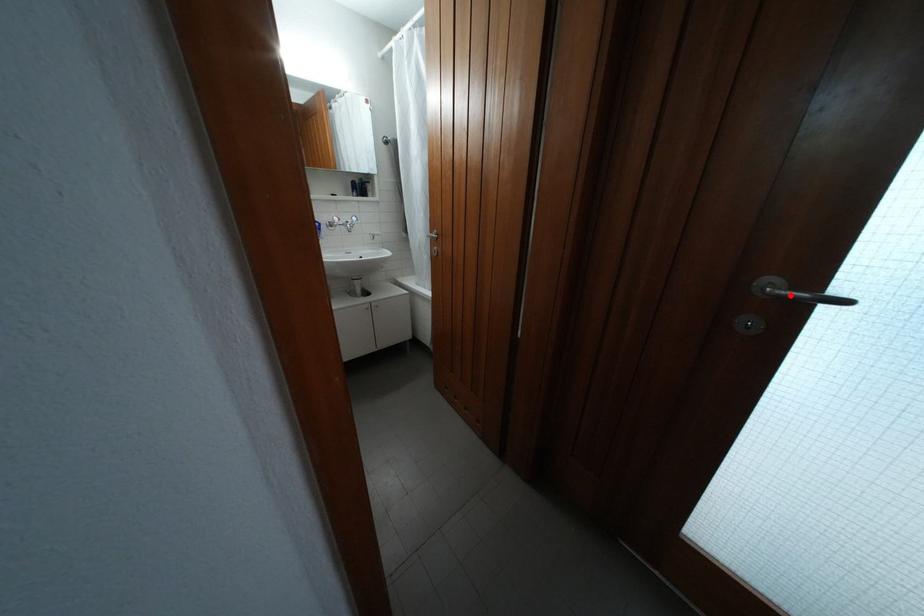
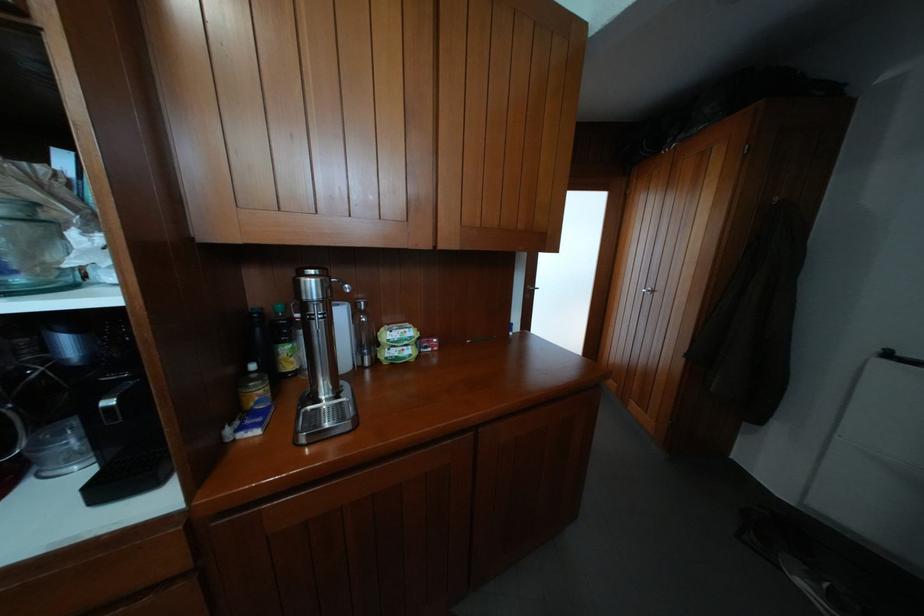
Question: I am providing you with two images of the same scene from different viewpoints. A red point is marked on the first image. At the location where the point appears in image 1, is it still visible in image 2?

Choices:
 (A) Yes
 (B) No

Answer: (B)